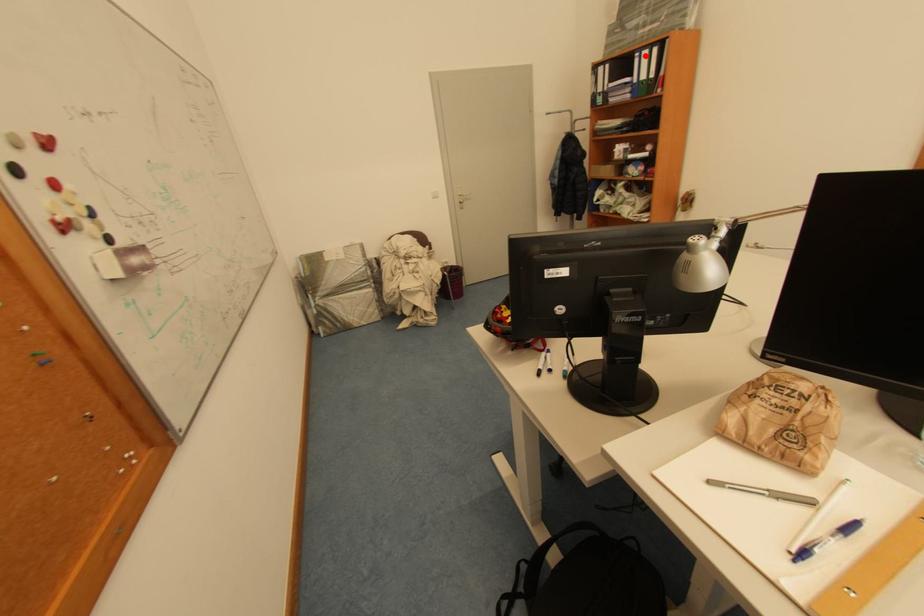
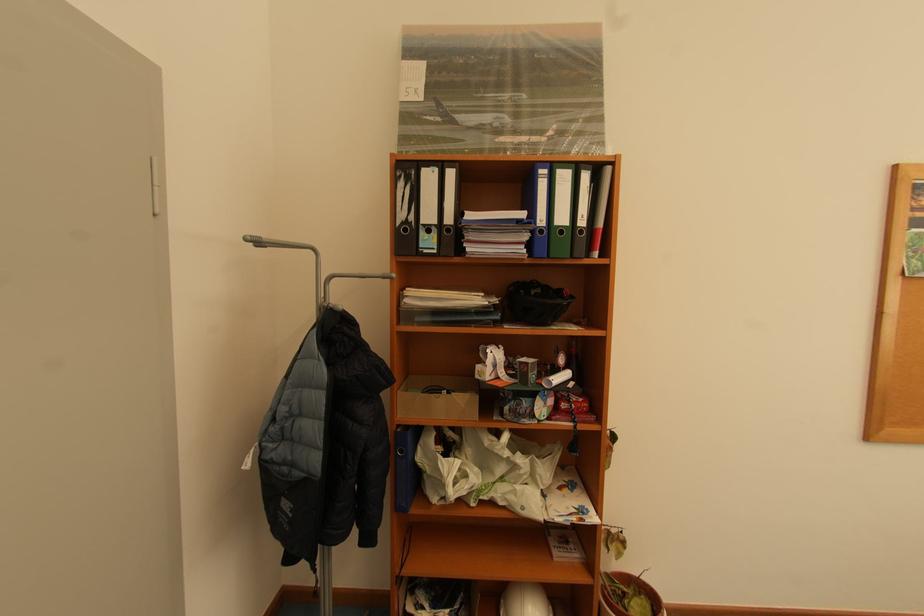
Where in the second image is the point corresponding to the highlighted location from the first image?

(552, 172)